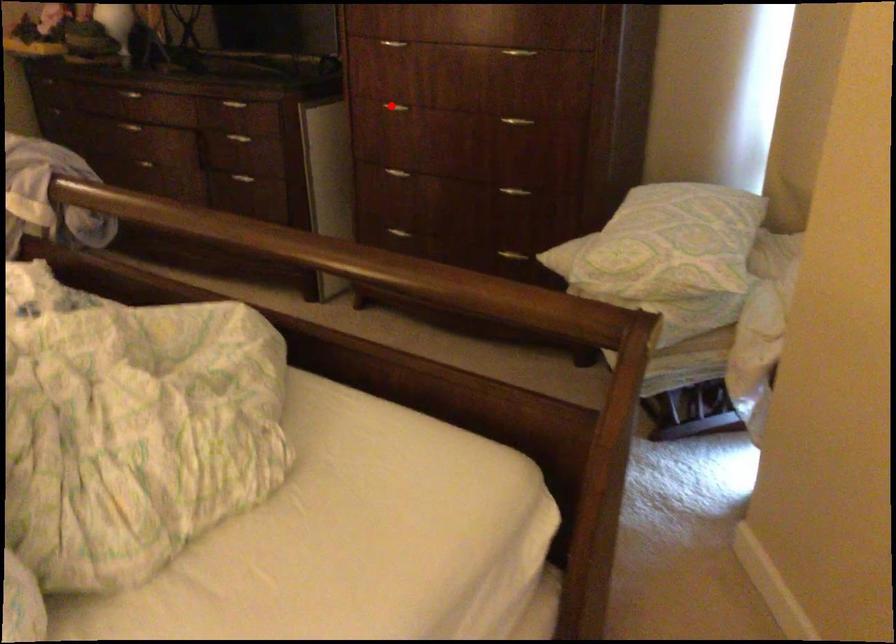
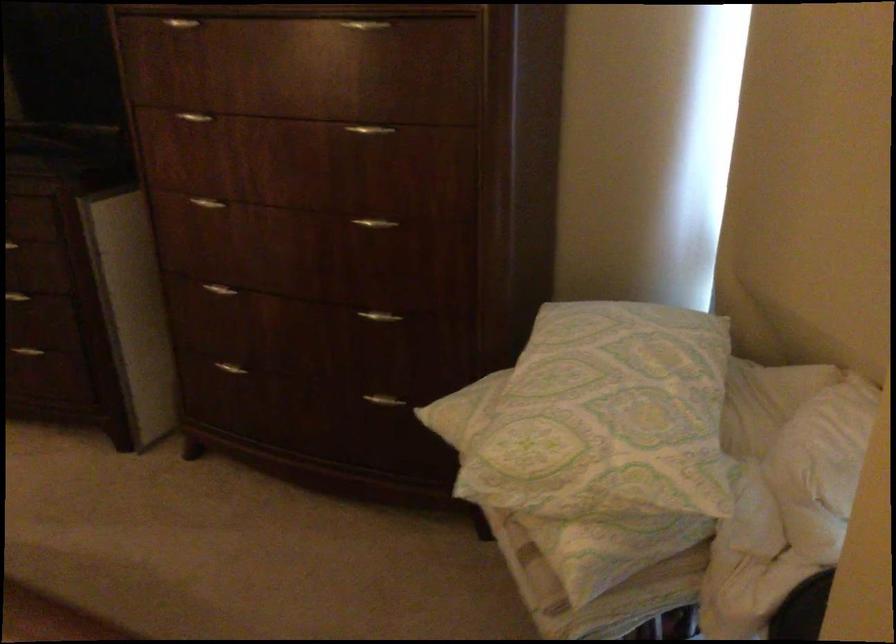
The point at the highlighted location is marked in the first image. Where is the corresponding point in the second image?

(207, 203)